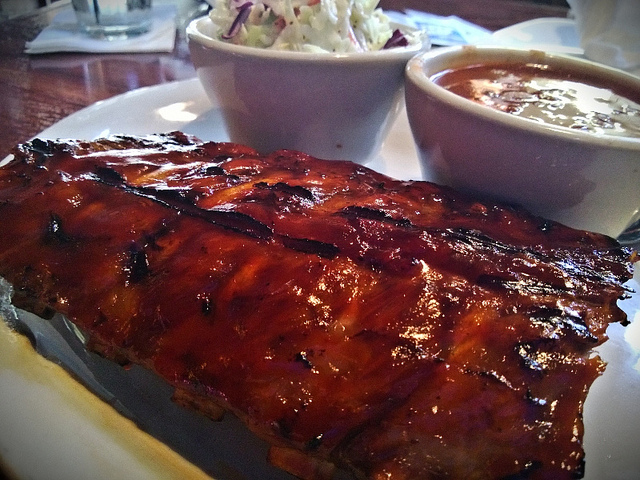
In order to click on plate under rack of ribs in this screenshot , I will do `click(95, 424)`.